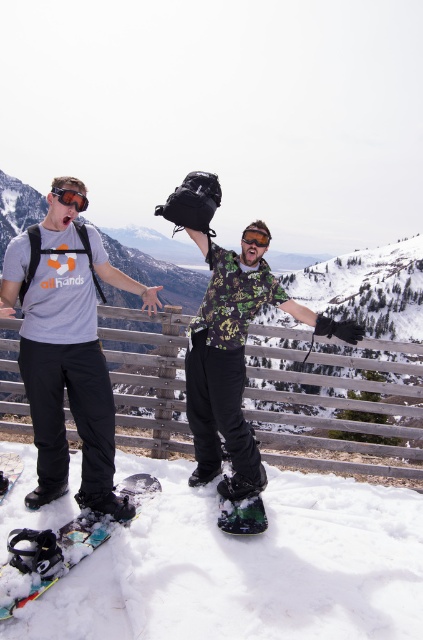
Question: Can you confirm if matte gray t-shirt at center is smaller than matte black goggles at upper left?

Choices:
 (A) no
 (B) yes

Answer: (A)

Question: Which point is farther to the camera?

Choices:
 (A) (25, 506)
 (B) (326, 396)
 (C) (255, 513)
 (D) (99, 388)

Answer: (B)

Question: Which point appears farthest from the camera in this image?

Choices:
 (A) (249, 227)
 (B) (74, 204)

Answer: (A)

Question: Is wooden at center to the right of multicolored composite snowboard at lower left from the viewer's perspective?

Choices:
 (A) yes
 (B) no

Answer: (A)

Question: From the image, what is the correct spatial relationship of wooden at center in relation to matte black goggles at upper left?

Choices:
 (A) left
 (B) right

Answer: (B)

Question: Which of the following is the farthest from the observer?

Choices:
 (A) matte black goggles at upper left
 (B) green matte snowshoe at center
 (C) white matte snowboard at lower left
 (D) multicolored composite snowboard at lower left

Answer: (C)